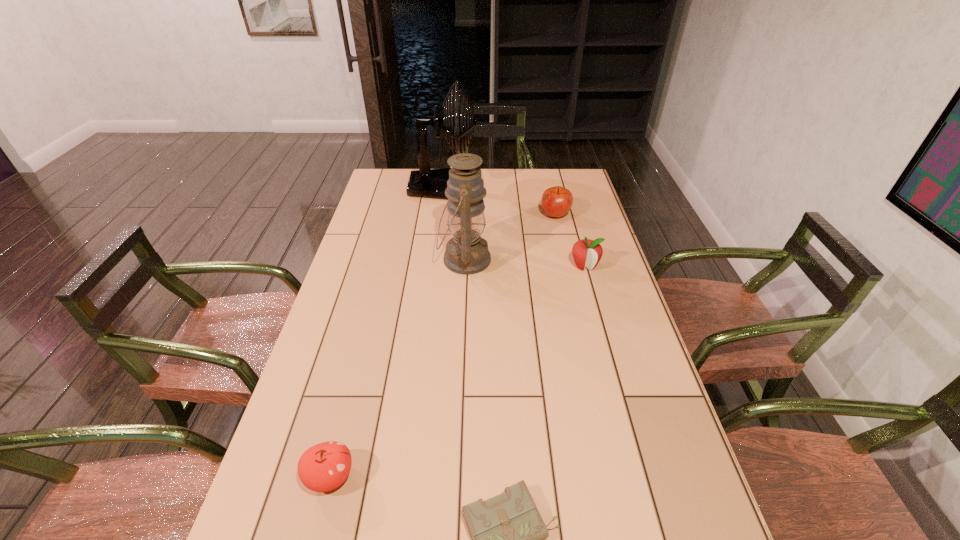
You are a GUI agent. You are given a task and a screenshot of the screen. Output one action in this format:
    pyautogui.click(x=<x>, y=<y>)
    Task: Click on the vacant region that satisfies the following two spatial constraints: 1. on the front side of the second farthest apple; 2. on the right side of the fifth nearest object
    The image size is (960, 540).
    Given the screenshot: What is the action you would take?
    pyautogui.click(x=567, y=266)

Find the location of a particular element. vacant space that satisfies the following two spatial constraints: 1. on the front side of the fifth nearest object; 2. on the left side of the second nearest apple is located at coordinates (567, 266).

The image size is (960, 540). I want to click on blank space that satisfies the following two spatial constraints: 1. in front of the second farthest object to blow air; 2. on the right side of the farthest object, so click(440, 215).

I want to click on vacant position in the image that satisfies the following two spatial constraints: 1. in front of the farthest object to blow air; 2. on the left side of the second farthest apple, so click(x=434, y=266).

Where is `free spot that satisfies the following two spatial constraints: 1. in front of the fan to blow air; 2. on the left side of the fifth nearest object`? free spot that satisfies the following two spatial constraints: 1. in front of the fan to blow air; 2. on the left side of the fifth nearest object is located at coordinates point(440,215).